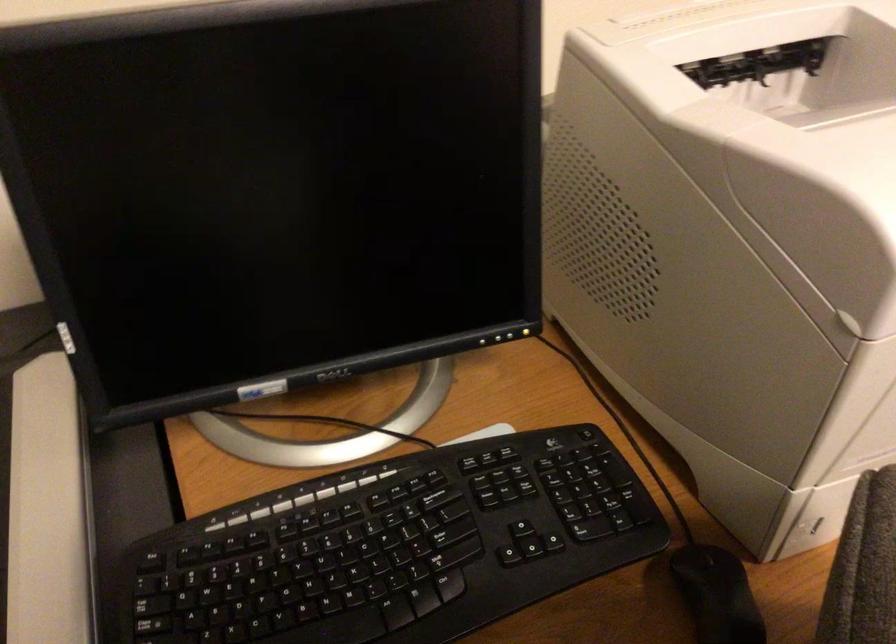
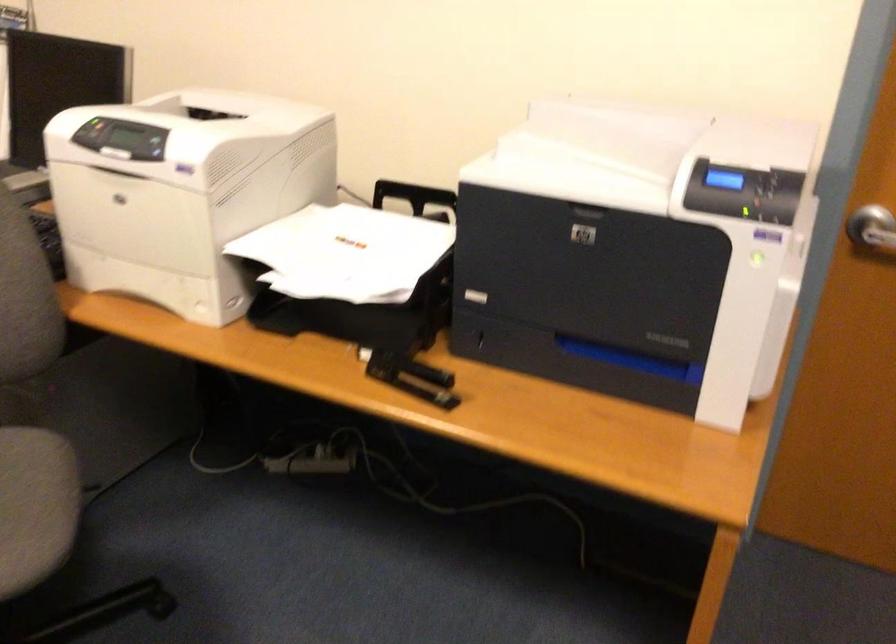
Question: I am providing you with two images of the same scene from different viewpoints. Which of the following objects are not visible in image2?

Choices:
 (A) printer control buttons
 (B) black stapler
 (C) black and white cup
 (D) printer top cover

Answer: (D)